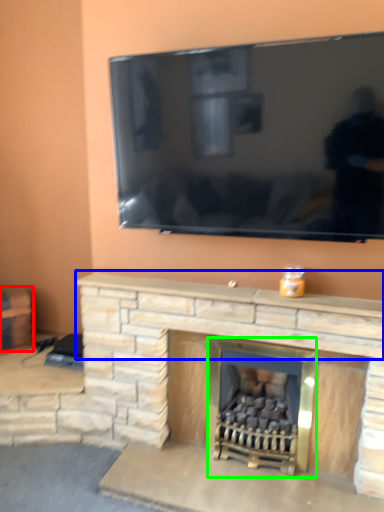
Question: Estimate the real-world distances between objects in this image. Which object is farther from furniture (highlighted by a red box), mantle (highlighted by a blue box) or fireplace (highlighted by a green box)?

Choices:
 (A) mantle
 (B) fireplace

Answer: (B)